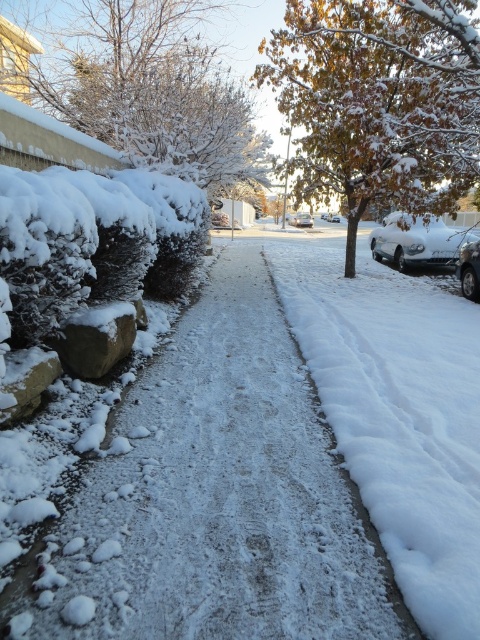
Is white snow-covered pavement at center below sleek silver sedan at right?

Indeed, white snow-covered pavement at center is positioned under sleek silver sedan at right.

Which is below, white snow-covered pavement at center or sleek silver sedan at right?

Positioned lower is white snow-covered pavement at center.

Who is more distant from viewer, (x=160, y=552) or (x=468, y=257)?

The point (x=468, y=257) is more distant.

Locate an element on the screen. The width and height of the screenshot is (480, 640). white snow-covered pavement at center is located at coordinates (216, 499).

Is snow-covered tree at upper center shorter than white frosty bush at upper left?

Indeed, snow-covered tree at upper center has a lesser height compared to white frosty bush at upper left.

Which is behind, point (470, 113) or point (195, 172)?

The point (195, 172) is behind.

Between point (321, 96) and point (152, 148), which one is positioned behind?

The point (321, 96) is more distant.

What are the coordinates of `snow-covered tree at upper center` in the screenshot? It's located at (380, 100).

Which is in front, point (333, 163) or point (326, 212)?

Point (333, 163) is in front.

Is point (432, 72) more distant than point (338, 220)?

That is False.

Locate an element on the screen. This screenshot has width=480, height=640. snow-covered tree at upper center is located at coordinates (380, 100).